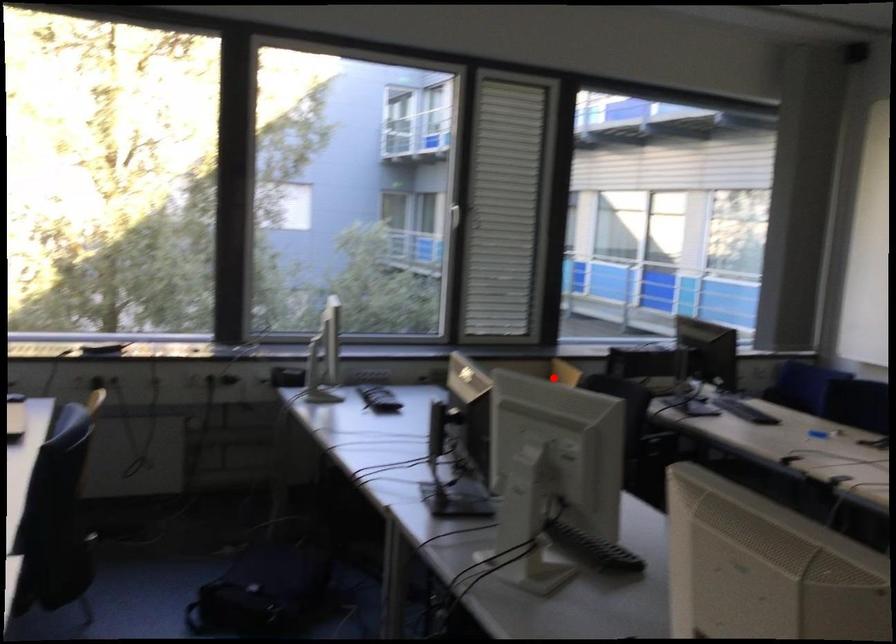
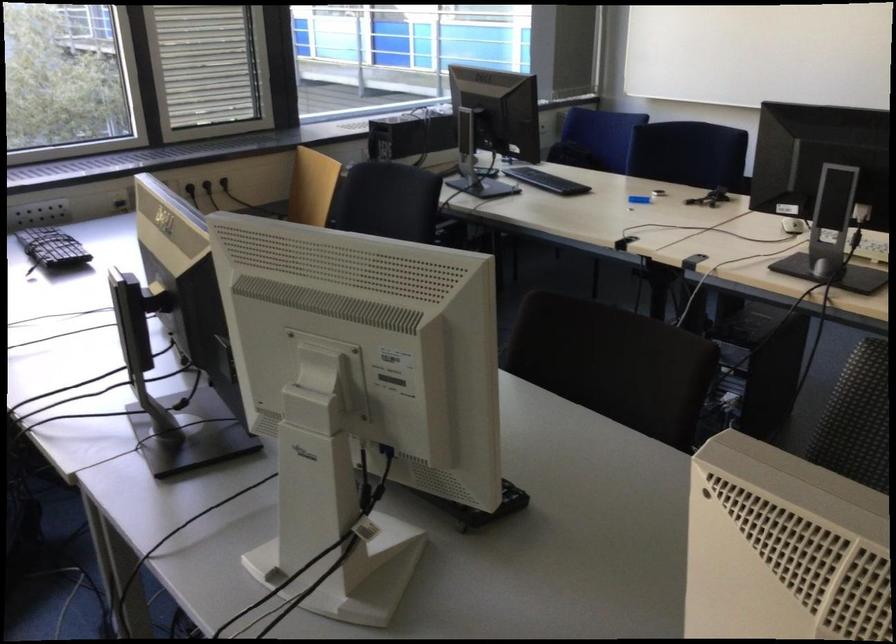
In the second image, find the point that corresponds to the highlighted location in the first image.

(312, 187)